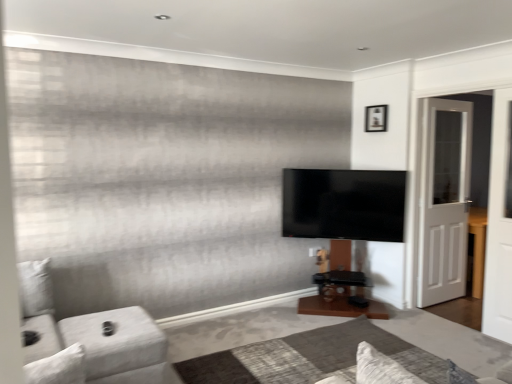
Question: Can you confirm if wooden picture frame at upper right is taller than white wooden door at right?

Choices:
 (A) yes
 (B) no

Answer: (B)

Question: From the image's perspective, is wooden picture frame at upper right under white wooden door at right?

Choices:
 (A) yes
 (B) no

Answer: (B)

Question: Is wooden picture frame at upper right wider than white wooden door at right?

Choices:
 (A) yes
 (B) no

Answer: (B)

Question: Is wooden picture frame at upper right thinner than white wooden door at right?

Choices:
 (A) no
 (B) yes

Answer: (B)

Question: Is the depth of wooden picture frame at upper right less than that of white wooden door at right?

Choices:
 (A) yes
 (B) no

Answer: (B)

Question: Does wooden picture frame at upper right touch white wooden door at right?

Choices:
 (A) yes
 (B) no

Answer: (B)

Question: Does white fabric couch at lower left have a smaller size compared to matte black tv at center?

Choices:
 (A) no
 (B) yes

Answer: (A)

Question: Is white fabric couch at lower left in contact with matte black tv at center?

Choices:
 (A) no
 (B) yes

Answer: (A)

Question: Is white fabric couch at lower left closer to the viewer compared to matte black tv at center?

Choices:
 (A) no
 (B) yes

Answer: (B)

Question: Does white fabric couch at lower left have a lesser width compared to matte black tv at center?

Choices:
 (A) yes
 (B) no

Answer: (B)

Question: From a real-world perspective, is white fabric couch at lower left physically above matte black tv at center?

Choices:
 (A) no
 (B) yes

Answer: (A)

Question: Would you say matte black tv at center is part of white fabric couch at lower left's contents?

Choices:
 (A) yes
 (B) no

Answer: (B)

Question: Can you confirm if matte black tv at center is taller than white fabric couch at lower left?

Choices:
 (A) yes
 (B) no

Answer: (B)